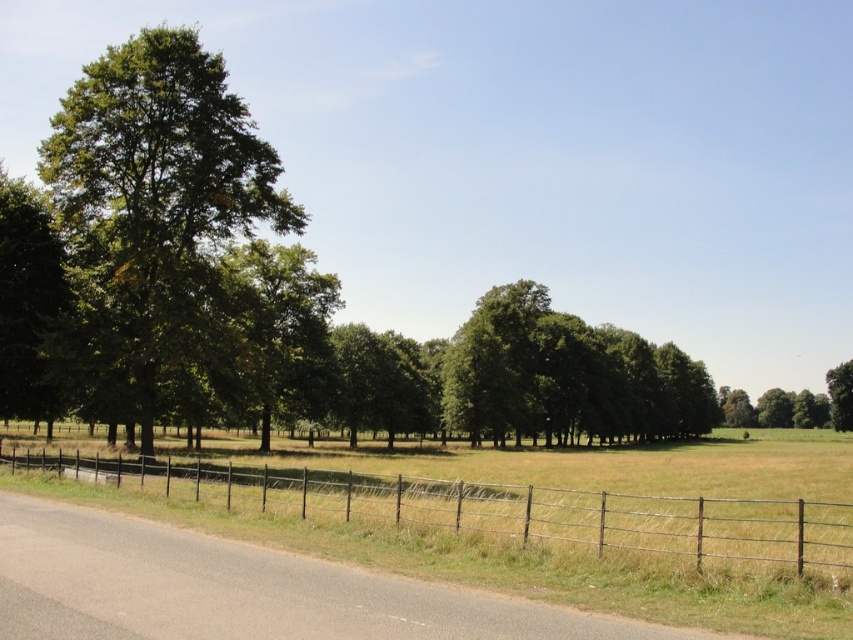
Question: Which of the following is the farthest from the observer?

Choices:
 (A) metallic wire fence at lower center
 (B) green leafy tree at left
 (C) green leafy tree at right

Answer: (C)

Question: From the image, what is the correct spatial relationship of green leafy tree at left in relation to green leafy tree at right?

Choices:
 (A) below
 (B) above

Answer: (B)

Question: Which of the following is the closest to the observer?

Choices:
 (A) (846, 416)
 (B) (177, 232)
 (C) (486, 490)

Answer: (C)

Question: Which of these objects is positioned farthest from the green leafy tree at right?

Choices:
 (A) green leafy tree at left
 (B) metallic wire fence at lower center

Answer: (A)

Question: Is metallic wire fence at lower center further to the viewer compared to green leafy tree at right?

Choices:
 (A) yes
 (B) no

Answer: (B)

Question: Is green leafy tree at left wider than metallic wire fence at lower center?

Choices:
 (A) yes
 (B) no

Answer: (B)